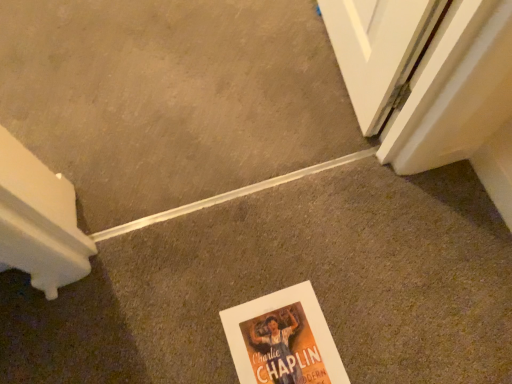
The width and height of the screenshot is (512, 384). What do you see at coordinates (283, 340) in the screenshot?
I see `white paper poster at center` at bounding box center [283, 340].

You are a GUI agent. You are given a task and a screenshot of the screen. Output one action in this format:
    pyautogui.click(x=<x>, y=<y>)
    Task: Click on the white paper poster at center
    This screenshot has height=384, width=512.
    Given the screenshot: What is the action you would take?
    pyautogui.click(x=283, y=340)

Measure the distance between point [264,354] and camera.

The depth of point [264,354] is 34.80 inches.

Identify the location of white paper poster at center. The image size is (512, 384). (283, 340).